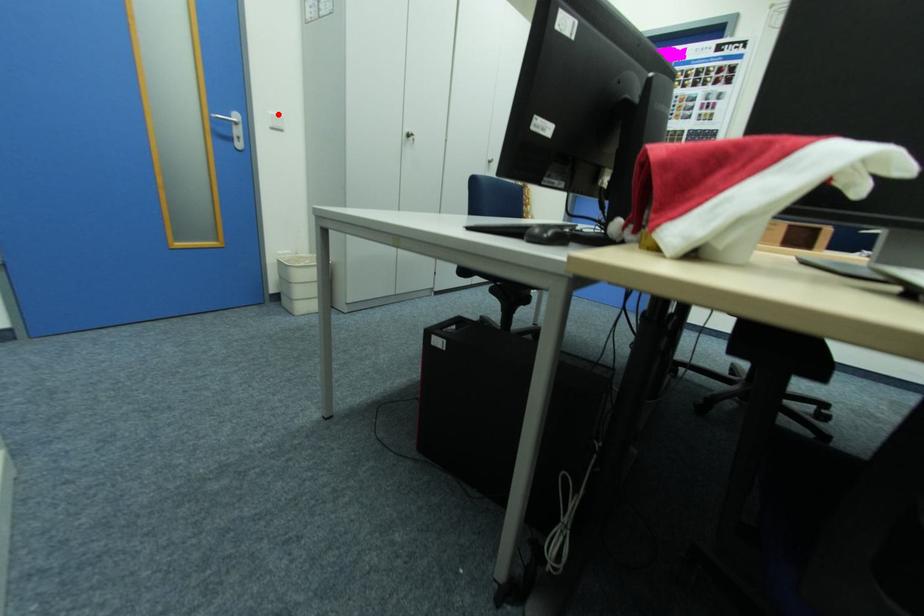
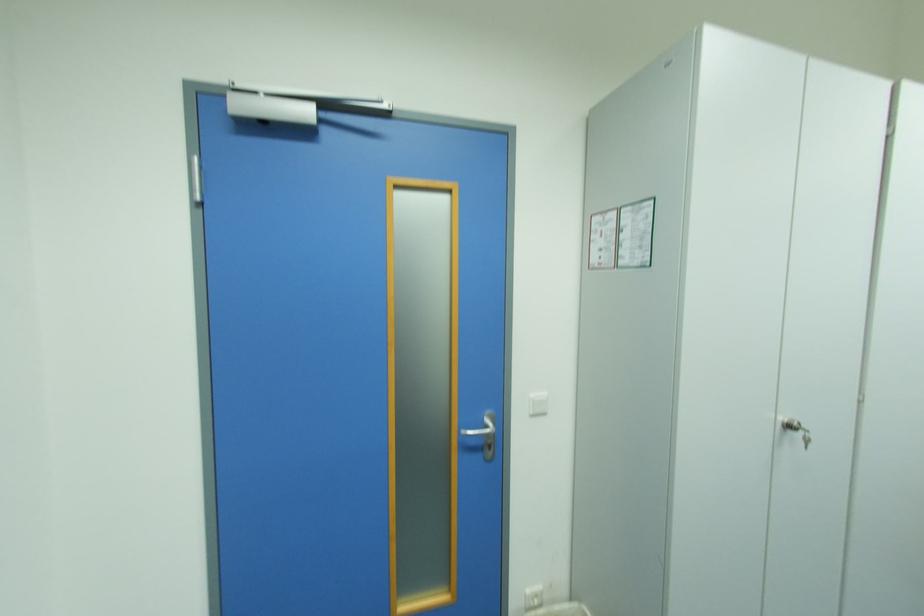
The point at the highlighted location is marked in the first image. Where is the corresponding point in the second image?

(540, 395)